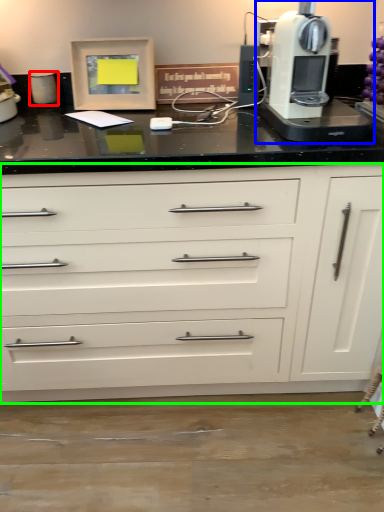
Question: Which object is the farthest from kitchen appliance (highlighted by a red box)? Choose among these: home appliance (highlighted by a blue box) or chest of drawers (highlighted by a green box).

Choices:
 (A) home appliance
 (B) chest of drawers

Answer: (B)